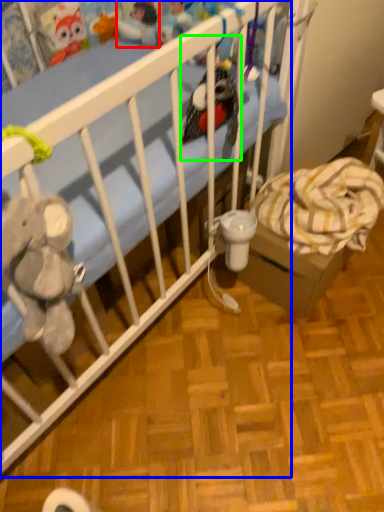
Question: Which object is positioned farthest from toy (highlighted by a red box)? Select from infant bed (highlighted by a blue box) and toy (highlighted by a green box).

Choices:
 (A) infant bed
 (B) toy

Answer: (A)